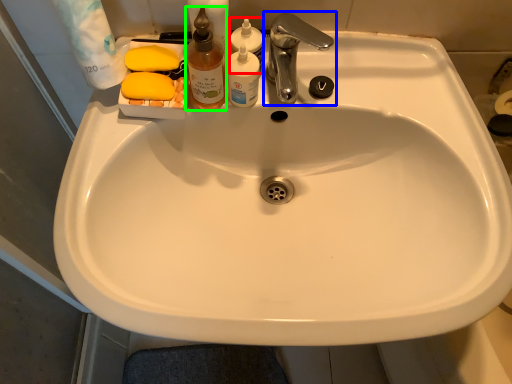
Question: Which object is the farthest from cleaning product (highlighted by a red box)? Choose among these: tap (highlighted by a blue box) or cleaning product (highlighted by a green box).

Choices:
 (A) tap
 (B) cleaning product

Answer: (B)